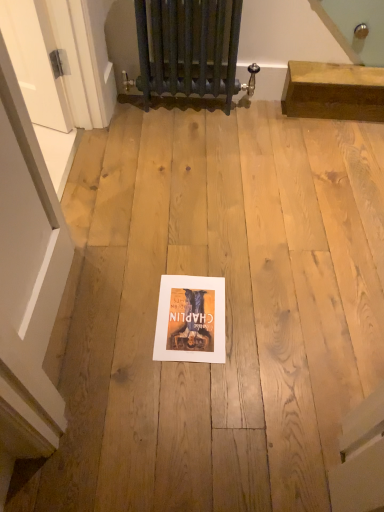
What do you see at coordinates (190, 319) in the screenshot? This screenshot has width=384, height=512. I see `matte paper postcard at center` at bounding box center [190, 319].

The width and height of the screenshot is (384, 512). Identify the location of matte paper postcard at center. (190, 319).

What is the approximate width of matte paper postcard at center?

11.96 inches.

Locate an element on the screen. Image resolution: width=384 pixels, height=512 pixels. matte paper postcard at center is located at coordinates (190, 319).